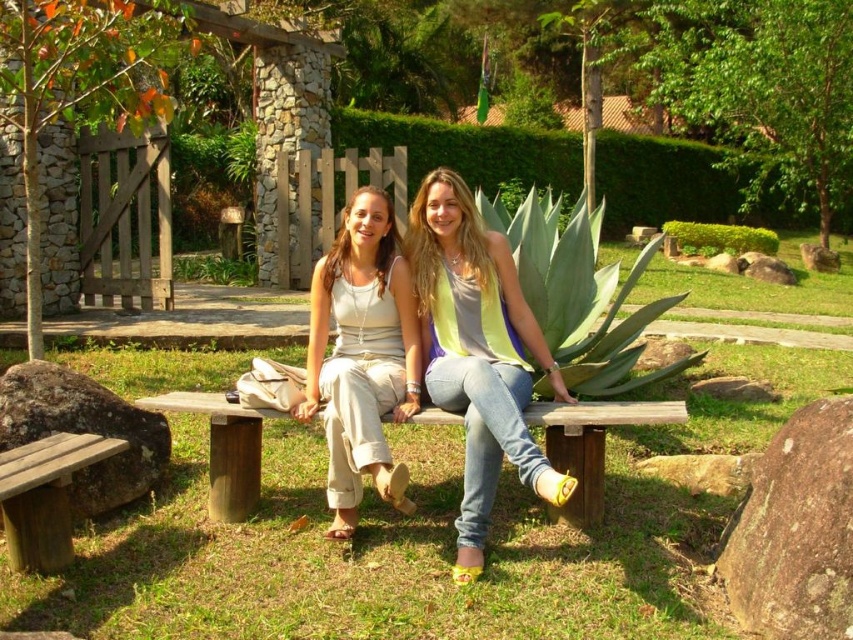
You are a photographer setting up a shoot in this garden scene. You need to place a small prop between the beige cotton tank top at center and the brown rough rock at lower right. Based on their positions, where should you place the prop to ensure it is between them?

The beige cotton tank top at center is above the brown rough rock at lower right, so you should place the prop between them by positioning it below the beige cotton tank top at center and above the brown rough rock at lower right.

Please provide the coordinates of the matte gray tank top at center in the image. The coordinate system is defined with the origin at the bottom left corner of the image, and the x and y axes increasing to the right and upward respectively. The coordinates are normalized between 0 and 1. Please answer with the exact values from the description.

The coordinates of the matte gray tank top at center are at point (477, 353).

You are standing in the garden and want to take a photo of the beige cotton tank top at center. The camera you have is 3.5 meters away from the tank top. Is the camera within the recommended 3.5 meters range for clear photos?

The beige cotton tank top at center and camera are 3.38 meters apart from each other, so the camera is within the recommended 3.5 meters range for clear photos.